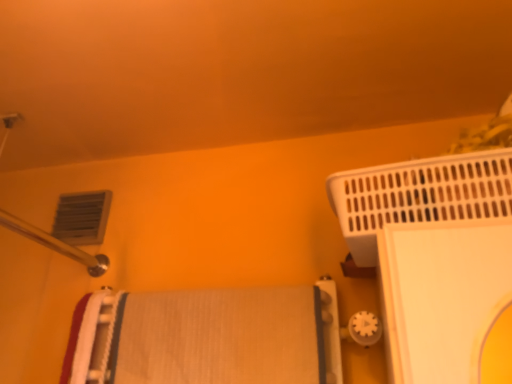
Question: From the image's perspective, is matte plastic air conditioning at upper left positioned above or below white textured bath towel at center?

Choices:
 (A) above
 (B) below

Answer: (A)

Question: Is matte plastic air conditioning at upper left to the left or to the right of white textured bath towel at center in the image?

Choices:
 (A) left
 (B) right

Answer: (A)

Question: Which object is the closest to the matte plastic air conditioning at upper left?

Choices:
 (A) white plastic bath heater at upper right
 (B) white textured bath towel at center

Answer: (B)

Question: Estimate the real-world distances between objects in this image. Which object is farther from the white plastic bath heater at upper right?

Choices:
 (A) white textured bath towel at center
 (B) matte plastic air conditioning at upper left

Answer: (B)